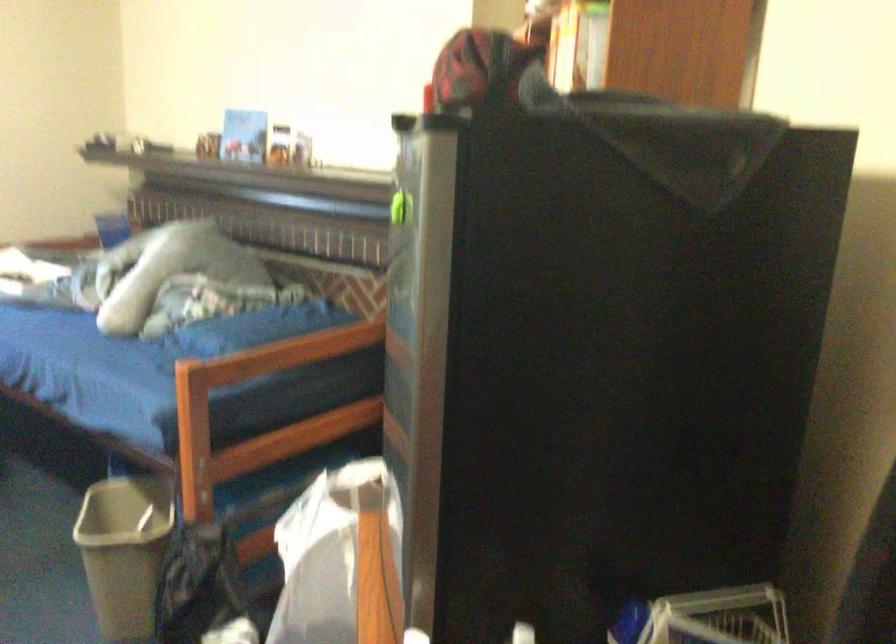
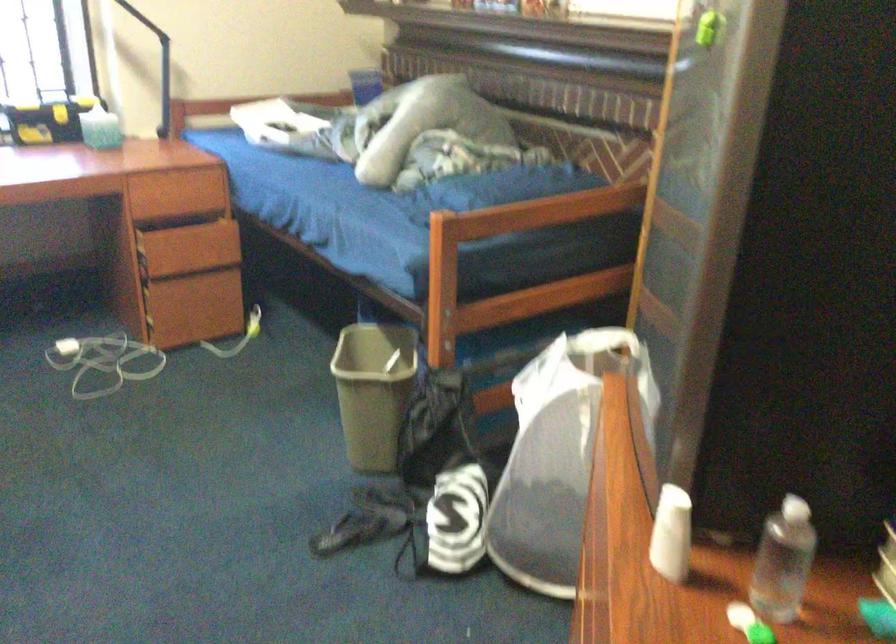
Question: What movement of the cameraman would produce the second image?

Choices:
 (A) Left
 (B) Right
 (C) Forward
 (D) Backward

Answer: (A)